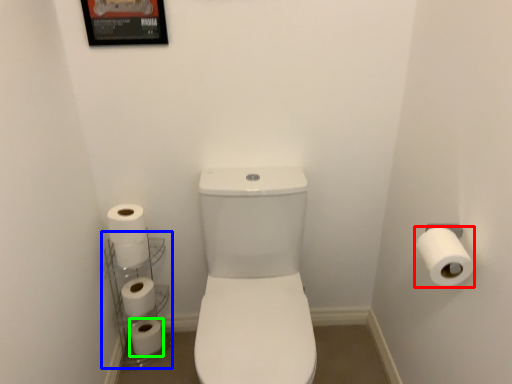
Question: Considering the real-world distances, which object is farthest from toilet paper (highlighted by a red box)? shelf (highlighted by a blue box) or toilet paper (highlighted by a green box)?

Choices:
 (A) shelf
 (B) toilet paper

Answer: (B)